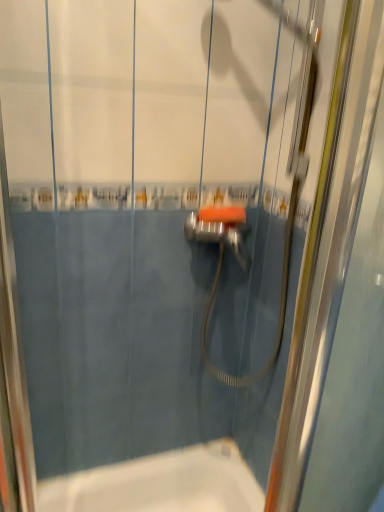
Locate an element on the screen. The height and width of the screenshot is (512, 384). white glossy bathtub at lower center is located at coordinates point(160,484).

This screenshot has height=512, width=384. What do you see at coordinates (160, 484) in the screenshot? I see `white glossy bathtub at lower center` at bounding box center [160, 484].

This screenshot has width=384, height=512. In order to click on white glossy bathtub at lower center in this screenshot , I will do `click(160, 484)`.